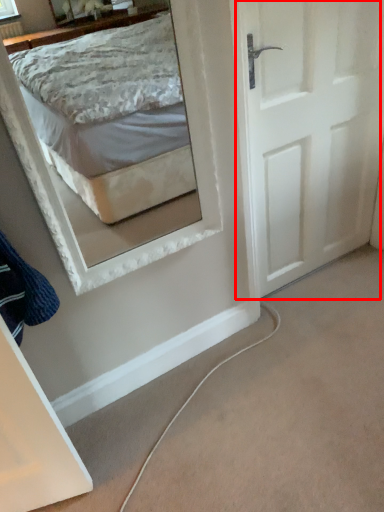
Question: Considering the relative positions of door (annotated by the red box) and clothe in the image provided, where is door (annotated by the red box) located with respect to the staircase?

Choices:
 (A) left
 (B) right

Answer: (B)